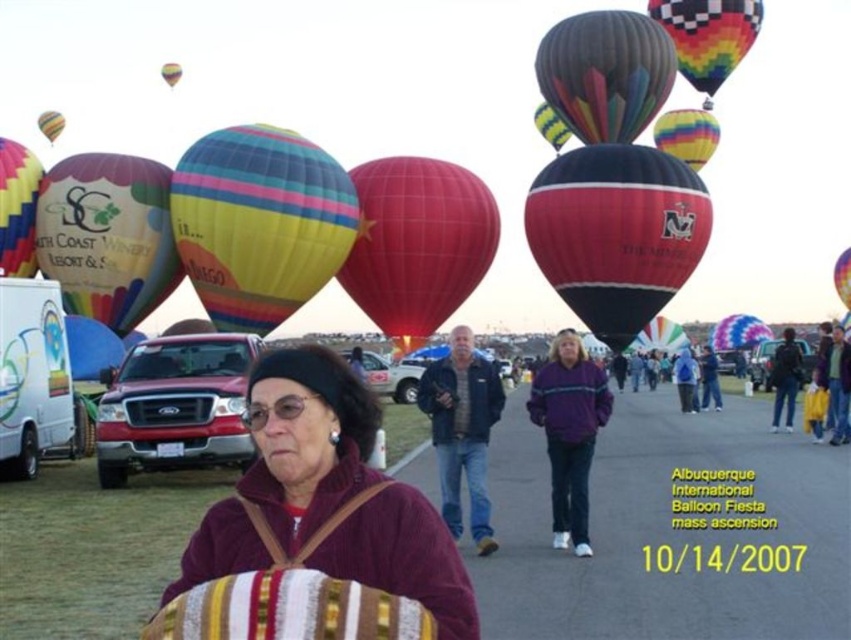
Question: Based on their relative distances, which object is nearer to the multicolored striped fabric hot air balloon at upper center?

Choices:
 (A) matte multicolored hot air balloon at left
 (B) matte yellow balloon at left
 (C) dark blue jacket at center
 (D) multicolored striped fabric hot air balloon at center

Answer: (C)

Question: Considering the real-world distances, which object is closest to the matte yellow balloon at left?

Choices:
 (A) black glossy hot air balloon at center
 (B) maroon sweater at center

Answer: (B)

Question: Is matte yellow balloon at left closer to the viewer compared to multicolored fabric balloon at center?

Choices:
 (A) yes
 (B) no

Answer: (A)

Question: Does maroon sweater at center have a larger size compared to yellow-green striped fabric at upper center?

Choices:
 (A) yes
 (B) no

Answer: (A)

Question: Among these objects, which one is nearest to the camera?

Choices:
 (A) matte multicolored balloon at upper left
 (B) denim jacket at center
 (C) multicolored striped fabric hot air balloon at upper center
 (D) matte yellow balloon at left

Answer: (B)

Question: Where is matte yellow balloon at left located in relation to matte multicolored balloon at upper left in the image?

Choices:
 (A) above
 (B) below

Answer: (B)